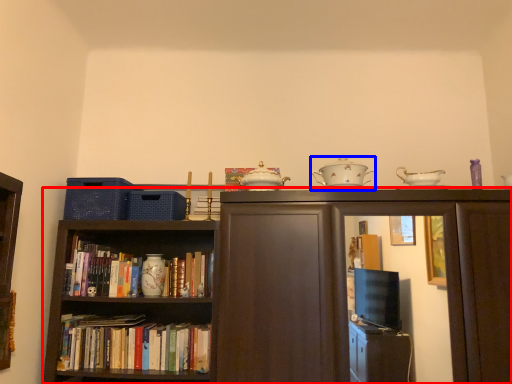
Question: Among these objects, which one is nearest to the camera, bookcase (highlighted by a red box) or tableware (highlighted by a blue box)?

Choices:
 (A) bookcase
 (B) tableware

Answer: (A)